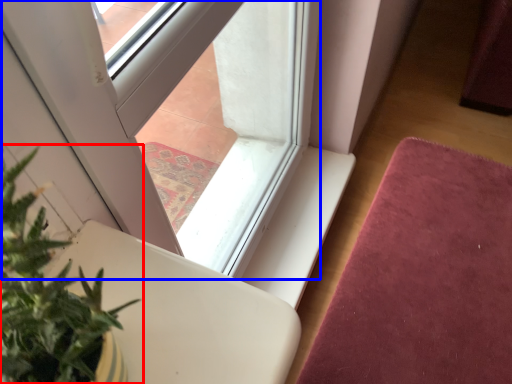
Question: Which point is closer to the camera, houseplant (highlighted by a red box) or window (highlighted by a blue box)?

Choices:
 (A) houseplant
 (B) window

Answer: (A)